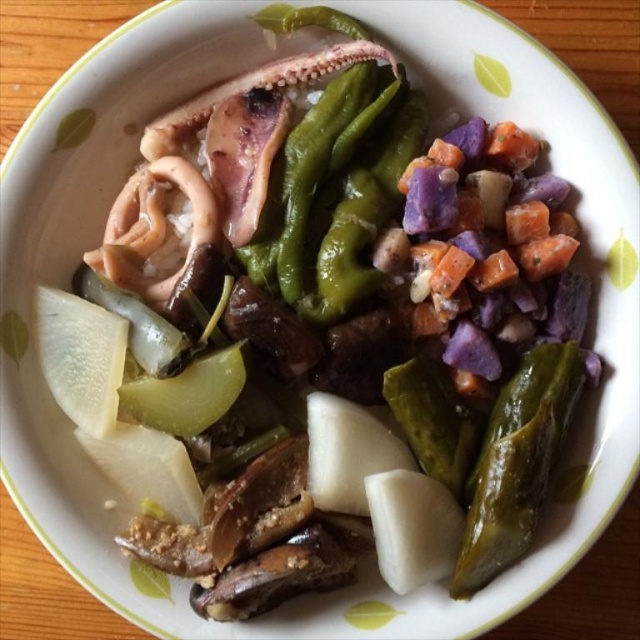
What is the 2D coordinate of the green glossy pepper at lower right in the image?

The green glossy pepper at lower right is located at the 2D coordinate point of (516, 461).